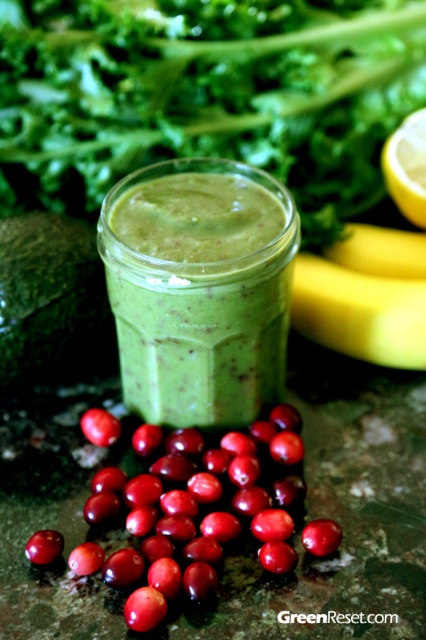
Question: Which point is farther from the camera taking this photo?

Choices:
 (A) (267, 470)
 (B) (324, 529)
 (C) (376, 243)
 (D) (287, 51)

Answer: (D)

Question: Which object appears farthest from the camera in this image?

Choices:
 (A) shiny red berry at lower left
 (B) yellow smooth skin banana at right

Answer: (A)

Question: Which object is the closest to the green leafy vegetable at upper center?

Choices:
 (A) yellow smooth skin banana at right
 (B) shiny red berries at lower left
 (C) yellow matte lemon at upper right
 (D) shiny red cherry at lower left

Answer: (A)

Question: Can you confirm if yellow smooth skin banana at right is positioned below shiny red berry at center?

Choices:
 (A) no
 (B) yes

Answer: (A)

Question: Where is green leafy vegetable at upper center located in relation to green matte smoothie at center in the image?

Choices:
 (A) below
 (B) above

Answer: (B)

Question: In this image, where is shiny red berries at lower left located relative to yellow matte lemon at upper right?

Choices:
 (A) left
 (B) right

Answer: (A)